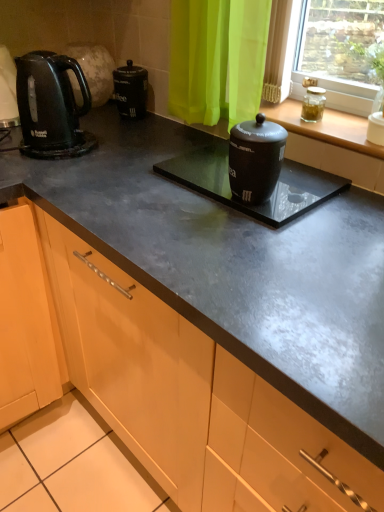
Image resolution: width=384 pixels, height=512 pixels. I want to click on matte black kettle at left, so click(51, 106).

Image resolution: width=384 pixels, height=512 pixels. In order to click on clear glass jar at upper right in this screenshot , I will do `click(338, 51)`.

The width and height of the screenshot is (384, 512). In order to click on clear glass jar at upper right, the 2th appliance in the bottom-to-top sequence in this screenshot , I will do `click(313, 104)`.

Locate an element on the screen. matte black kettle at left is located at coordinates (51, 106).

Is the depth of transparent glass jar at upper right less than that of clear glass jar at upper right?

No, it is not.

Can you confirm if transparent glass jar at upper right is wider than clear glass jar at upper right?

Indeed, transparent glass jar at upper right has a greater width compared to clear glass jar at upper right.

Is transparent glass jar at upper right taller or shorter than clear glass jar at upper right?

In the image, transparent glass jar at upper right appears to be shorter than clear glass jar at upper right.

In the image, is transparent glass jar at upper right on the left side or the right side of matte black kettle at left?

Clearly, transparent glass jar at upper right is on the right of matte black kettle at left in the image.

Is transparent glass jar at upper right facing towards matte black kettle at left?

No, transparent glass jar at upper right does not turn towards matte black kettle at left.

From a real-world perspective, is transparent glass jar at upper right on matte black kettle at left?

Actually, transparent glass jar at upper right is physically below matte black kettle at left in the real world.

Considering the sizes of objects clear glass jar at upper right and clear glass jar at upper right, which ranks as the 1th appliance in top-to-bottom order, in the image provided, who is wider, clear glass jar at upper right or clear glass jar at upper right, which ranks as the 1th appliance in top-to-bottom order,?

Wider between the two is clear glass jar at upper right.

From a real-world perspective, who is located lower, clear glass jar at upper right or clear glass jar at upper right, the 2th appliance in the bottom-to-top sequence?

clear glass jar at upper right, the 2th appliance in the bottom-to-top sequence, from a real-world perspective.

Where is `appliance that is the 1st object located below the clear glass jar at upper right (from the image's perspective)`? The height and width of the screenshot is (512, 384). appliance that is the 1st object located below the clear glass jar at upper right (from the image's perspective) is located at coordinates (313, 104).

From the picture: Which object is further away from the camera taking this photo, clear glass jar at upper right or clear glass jar at upper right, which ranks as the 1th appliance in top-to-bottom order?

Positioned behind is clear glass jar at upper right, which ranks as the 1th appliance in top-to-bottom order.

Is black matte canister at center, the 2th appliance from the top, not close to transparent glass jar at upper right?

Actually, black matte canister at center, the 2th appliance from the top, and transparent glass jar at upper right are a little close together.

Which of these two, black matte canister at center, the 2th appliance from the top, or transparent glass jar at upper right, is bigger?

With larger size is transparent glass jar at upper right.

Find the location of a particular element. The height and width of the screenshot is (512, 384). appliance that appears below the transparent glass jar at upper right (from a real-world perspective) is located at coordinates (244, 201).

Which is less distant, (17, 58) or (316, 97)?

The point (17, 58) is closer to the camera.

From the image's perspective, is matte black kettle at left under clear glass jar at upper right, the 2th appliance in the bottom-to-top sequence?

Incorrect, from the image's perspective, matte black kettle at left is higher than clear glass jar at upper right, the 2th appliance in the bottom-to-top sequence.

The width and height of the screenshot is (384, 512). Find the location of `kitchen appliance in front of the clear glass jar at upper right, the 2th appliance in the bottom-to-top sequence`. kitchen appliance in front of the clear glass jar at upper right, the 2th appliance in the bottom-to-top sequence is located at coordinates (51, 106).

Do you think matte black kettle at left is within clear glass jar at upper right, which ranks as the 1th appliance in top-to-bottom order, or outside of it?

matte black kettle at left lies outside clear glass jar at upper right, which ranks as the 1th appliance in top-to-bottom order.

Can you confirm if transparent glass jar at upper right is wider than clear glass jar at upper right, the 2th appliance in the bottom-to-top sequence?

Yes.

Is transparent glass jar at upper right inside or outside of clear glass jar at upper right, which ranks as the 1th appliance in top-to-bottom order?

transparent glass jar at upper right is located beyond the bounds of clear glass jar at upper right, which ranks as the 1th appliance in top-to-bottom order.

Considering the positions of objects transparent glass jar at upper right and clear glass jar at upper right, the 2th appliance in the bottom-to-top sequence, in the image provided, who is more to the right, transparent glass jar at upper right or clear glass jar at upper right, the 2th appliance in the bottom-to-top sequence,?

transparent glass jar at upper right is more to the right.

From the image's perspective, relative to clear glass jar at upper right, which ranks as the 1th appliance in top-to-bottom order, is transparent glass jar at upper right above or below?

Based on their image positions, transparent glass jar at upper right is located beneath clear glass jar at upper right, which ranks as the 1th appliance in top-to-bottom order.

Image resolution: width=384 pixels, height=512 pixels. I want to click on kitchen appliance behind the clear glass jar at upper right, so click(x=51, y=106).

Is point (78, 143) positioned after point (360, 32)?

Yes, point (78, 143) is farther from viewer.

From a real-world perspective, is matte black kettle at left positioned above or below clear glass jar at upper right?

matte black kettle at left is situated lower than clear glass jar at upper right in the real world.

In order to click on window above the transparent glass jar at upper right (from a real-world perspective) in this screenshot , I will do `click(338, 51)`.

Find the location of a particular element. This screenshot has width=384, height=512. window sill below the matte black kettle at left (from a real-world perspective) is located at coordinates (325, 127).

Based on their spatial positions, is clear glass jar at upper right, the 2th appliance in the bottom-to-top sequence, or clear glass jar at upper right closer to transparent glass jar at upper right?

The object closer to transparent glass jar at upper right is clear glass jar at upper right, the 2th appliance in the bottom-to-top sequence.

Looking at the image, which one is located closer to clear glass jar at upper right, which ranks as the 1th appliance in top-to-bottom order, black matte canister at center, the 2th appliance from the top, or clear glass jar at upper right?

Based on the image, clear glass jar at upper right appears to be nearer to clear glass jar at upper right, which ranks as the 1th appliance in top-to-bottom order.

Looking at the image, which one is located further to clear glass jar at upper right, matte black kettle at left or clear glass jar at upper right, which ranks as the 1th appliance in top-to-bottom order?

Among the two, matte black kettle at left is located further to clear glass jar at upper right.

Based on their spatial positions, is clear glass jar at upper right, which ranks as the 1th appliance in top-to-bottom order, or clear glass jar at upper right further from matte black kettle at left?

clear glass jar at upper right.

Which object lies further to the anchor point clear glass jar at upper right, matte black kettle at left or black matte canister at center, which ranks as the 1th appliance in bottom-to-top order?

The object further to clear glass jar at upper right is matte black kettle at left.

When comparing their distances from transparent glass jar at upper right, does black matte canister at center, the 2th appliance from the top, or clear glass jar at upper right, which ranks as the 1th appliance in top-to-bottom order, seem further?

Among the two, black matte canister at center, the 2th appliance from the top, is located further to transparent glass jar at upper right.

Looking at the image, which one is located further to black matte canister at center, which ranks as the 1th appliance in bottom-to-top order, clear glass jar at upper right, the 2th appliance in the bottom-to-top sequence, or matte black kettle at left?

matte black kettle at left is positioned further to the anchor black matte canister at center, which ranks as the 1th appliance in bottom-to-top order.

Based on their spatial positions, is matte black kettle at left or black matte canister at center, which ranks as the 1th appliance in bottom-to-top order, further from transparent glass jar at upper right?

Among the two, matte black kettle at left is located further to transparent glass jar at upper right.

The width and height of the screenshot is (384, 512). What are the coordinates of `window sill between black matte canister at center, the 2th appliance from the top, and clear glass jar at upper right` in the screenshot? It's located at pos(325,127).

Where is `appliance located between black matte canister at center, the 2th appliance from the top, and transparent glass jar at upper right in the left-right direction`? appliance located between black matte canister at center, the 2th appliance from the top, and transparent glass jar at upper right in the left-right direction is located at coordinates (313, 104).

Identify the location of appliance between matte black kettle at left and clear glass jar at upper right, the 2th appliance in the bottom-to-top sequence. (x=244, y=201).

Where is `appliance located between black matte canister at center, the 2th appliance from the top, and clear glass jar at upper right in the left-right direction`? appliance located between black matte canister at center, the 2th appliance from the top, and clear glass jar at upper right in the left-right direction is located at coordinates (313, 104).